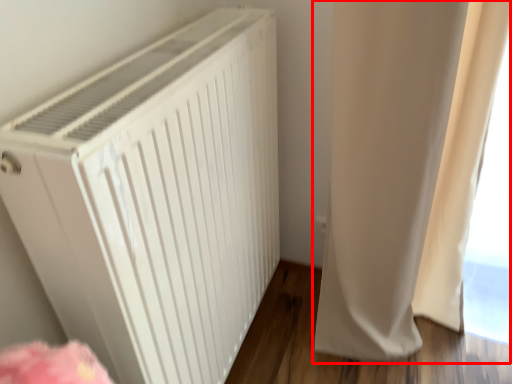
Question: Where is curtain (annotated by the red box) located in relation to home appliance in the image?

Choices:
 (A) left
 (B) right

Answer: (B)